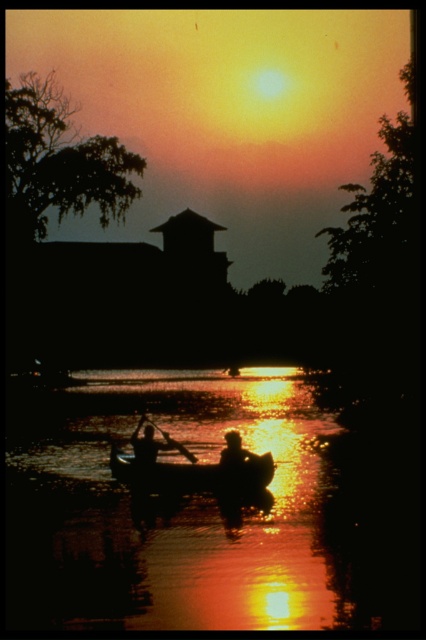
Is point (233, 433) positioned in front of point (189, 461)?

Yes, point (233, 433) is in front of point (189, 461).

Which is in front, point (230, 460) or point (154, 426)?

Positioned in front is point (230, 460).

Where is `silhouette human at center`? Image resolution: width=426 pixels, height=640 pixels. silhouette human at center is located at coordinates (235, 451).

Is silhouette wood canoe at center wider than silhouette wooden paddle at center?

Yes, silhouette wood canoe at center is wider than silhouette wooden paddle at center.

In the scene shown: Is silhouette wood canoe at center positioned at the back of silhouette wooden paddle at center?

No, it is in front of silhouette wooden paddle at center.

Locate an element on the screen. Image resolution: width=426 pixels, height=640 pixels. silhouette wood canoe at center is located at coordinates (192, 472).

Is silky water at center closer to the viewer compared to silhouette wooden paddle at center?

Yes.

Locate an element on the screen. This screenshot has width=426, height=640. silky water at center is located at coordinates (206, 512).

Does point (172, 428) lie behind point (152, 449)?

That is True.

Identify the location of silky water at center. Image resolution: width=426 pixels, height=640 pixels. (206, 512).